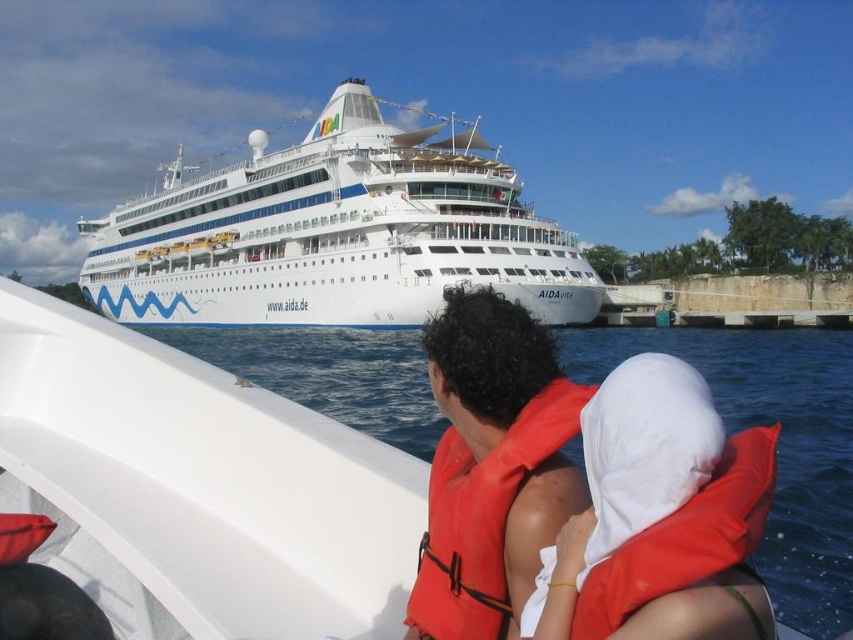
You are a photographer standing on the dock and want to capture both the white glossy cruise ship at upper center and the orange life jacket at center in your photo. Which object will appear larger in the final photograph?

The white glossy cruise ship at upper center will appear larger in the photograph because it is taller than the orange life jacket at center.